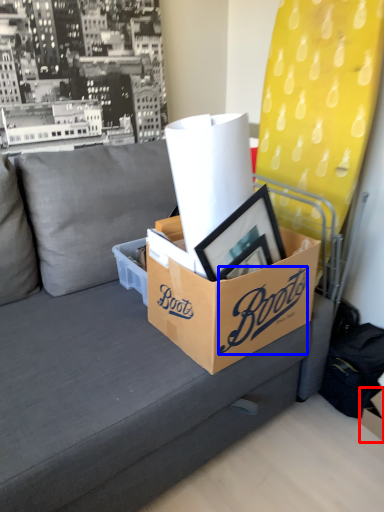
Question: Which point is further to the camera, storage box (highlighted by a red box) or writing (highlighted by a blue box)?

Choices:
 (A) storage box
 (B) writing

Answer: (A)